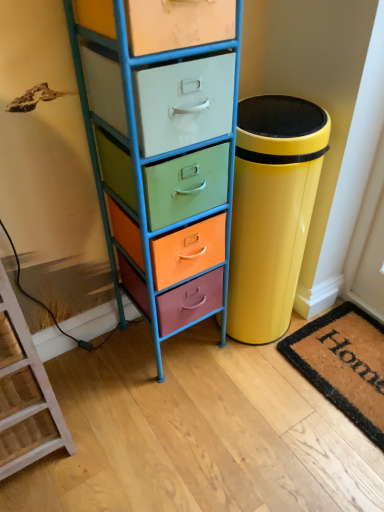
What do you see at coordinates (24, 393) in the screenshot?
I see `wooden ladder at lower left` at bounding box center [24, 393].

In order to face metallic multi-colored chest of drawers at left, should I rotate leftwards or rightwards?

You should look left and rotate roughly 3.491 degrees.

Where is `glossy yellow trash can at right`? glossy yellow trash can at right is located at coordinates (272, 210).

Image resolution: width=384 pixels, height=512 pixels. I want to click on wooden ladder at lower left, so click(x=24, y=393).

What's the angular difference between glossy yellow trash can at right and metallic multi-colored chest of drawers at left's facing directions?

There is a 5.59e-05-degree angle between the facing directions of glossy yellow trash can at right and metallic multi-colored chest of drawers at left.

From a real-world perspective, is glossy yellow trash can at right positioned under metallic multi-colored chest of drawers at left based on gravity?

Yes.

Where is `waste container behind the metallic multi-colored chest of drawers at left`? waste container behind the metallic multi-colored chest of drawers at left is located at coordinates (272, 210).

Considering the relative positions of glossy yellow trash can at right and metallic multi-colored chest of drawers at left in the image provided, is glossy yellow trash can at right to the right of metallic multi-colored chest of drawers at left from the viewer's perspective?

Correct, you'll find glossy yellow trash can at right to the right of metallic multi-colored chest of drawers at left.

In terms of height, does glossy yellow trash can at right look taller or shorter compared to coir doormat at lower right?

In the image, glossy yellow trash can at right appears to be taller than coir doormat at lower right.

Based on the photo, choose the correct answer: Is glossy yellow trash can at right inside coir doormat at lower right or outside it?

glossy yellow trash can at right is not enclosed by coir doormat at lower right.

From the picture: Does glossy yellow trash can at right have a smaller size compared to coir doormat at lower right?

No.

Does point (251, 137) come farther from viewer compared to point (314, 339)?

That is False.

Does metallic multi-colored chest of drawers at left have a lesser height compared to coir doormat at lower right?

No.

Is metallic multi-colored chest of drawers at left far from coir doormat at lower right?

That's not correct — metallic multi-colored chest of drawers at left is a little close to coir doormat at lower right.

The height and width of the screenshot is (512, 384). Identify the location of mat below the metallic multi-colored chest of drawers at left (from a real-world perspective). (344, 364).

From the image's perspective, is metallic multi-colored chest of drawers at left above or below coir doormat at lower right?

From the image's perspective, metallic multi-colored chest of drawers at left appears above coir doormat at lower right.

Can you confirm if coir doormat at lower right is smaller than glossy yellow trash can at right?

Indeed, coir doormat at lower right has a smaller size compared to glossy yellow trash can at right.

Is coir doormat at lower right with glossy yellow trash can at right?

No, coir doormat at lower right is not making contact with glossy yellow trash can at right.

In order to click on mat located on the right of glossy yellow trash can at right in this screenshot , I will do `click(344, 364)`.

Does coir doormat at lower right appear on the left side of glossy yellow trash can at right?

No, coir doormat at lower right is not to the left of glossy yellow trash can at right.

In the scene shown: Is coir doormat at lower right turned away from wooden ladder at lower left?

No, wooden ladder at lower left is not at the back of coir doormat at lower right.

Looking at this image, in terms of size, does coir doormat at lower right appear bigger or smaller than wooden ladder at lower left?

coir doormat at lower right is smaller than wooden ladder at lower left.

Is coir doormat at lower right taller or shorter than wooden ladder at lower left?

coir doormat at lower right is shorter than wooden ladder at lower left.

From the image's perspective, which object appears higher, coir doormat at lower right or wooden ladder at lower left?

wooden ladder at lower left.

Which object is more forward, wooden ladder at lower left or metallic multi-colored chest of drawers at left?

wooden ladder at lower left is in front.

Measure the distance between wooden ladder at lower left and metallic multi-colored chest of drawers at left.

wooden ladder at lower left and metallic multi-colored chest of drawers at left are 18.93 inches apart.

Which object is positioned more to the left, wooden ladder at lower left or metallic multi-colored chest of drawers at left?

wooden ladder at lower left is more to the left.

In terms of height, does wooden ladder at lower left look taller or shorter compared to metallic multi-colored chest of drawers at left?

wooden ladder at lower left is shorter than metallic multi-colored chest of drawers at left.

Is wooden ladder at lower left shorter than glossy yellow trash can at right?

No, wooden ladder at lower left is not shorter than glossy yellow trash can at right.

From a real-world perspective, is wooden ladder at lower left under glossy yellow trash can at right?

Incorrect, from a real-world perspective, wooden ladder at lower left is higher than glossy yellow trash can at right.

Is wooden ladder at lower left to the left of glossy yellow trash can at right from the viewer's perspective?

Yes.

Considering the relative sizes of wooden ladder at lower left and glossy yellow trash can at right in the image provided, is wooden ladder at lower left thinner than glossy yellow trash can at right?

In fact, wooden ladder at lower left might be wider than glossy yellow trash can at right.

I want to click on the chest of drawers positioned vertically above the glossy yellow trash can at right (from a real-world perspective), so click(164, 167).

Find the location of a particular element. waste container in front of the coir doormat at lower right is located at coordinates (272, 210).

Based on their spatial positions, is glossy yellow trash can at right or coir doormat at lower right closer to wooden ladder at lower left?

Based on the image, glossy yellow trash can at right appears to be nearer to wooden ladder at lower left.

Looking at the image, which one is located further to glossy yellow trash can at right, metallic multi-colored chest of drawers at left or coir doormat at lower right?

Among the two, coir doormat at lower right is located further to glossy yellow trash can at right.

When comparing their distances from glossy yellow trash can at right, does wooden ladder at lower left or coir doormat at lower right seem closer?

coir doormat at lower right is closer to glossy yellow trash can at right.

In the scene shown: Looking at the image, which one is located closer to coir doormat at lower right, glossy yellow trash can at right or wooden ladder at lower left?

glossy yellow trash can at right is closer to coir doormat at lower right.

Based on their spatial positions, is metallic multi-colored chest of drawers at left or wooden ladder at lower left further from glossy yellow trash can at right?

Based on the image, wooden ladder at lower left appears to be further to glossy yellow trash can at right.

Consider the image. Which object lies nearer to the anchor point glossy yellow trash can at right, wooden ladder at lower left or metallic multi-colored chest of drawers at left?

metallic multi-colored chest of drawers at left lies closer to glossy yellow trash can at right than the other object.

From the image, which object appears to be nearer to coir doormat at lower right, metallic multi-colored chest of drawers at left or wooden ladder at lower left?

Among the two, metallic multi-colored chest of drawers at left is located nearer to coir doormat at lower right.

Which object lies nearer to the anchor point wooden ladder at lower left, glossy yellow trash can at right or metallic multi-colored chest of drawers at left?

metallic multi-colored chest of drawers at left.

Identify the location of waste container situated between metallic multi-colored chest of drawers at left and coir doormat at lower right from left to right. This screenshot has width=384, height=512. (272, 210).

The height and width of the screenshot is (512, 384). I want to click on chest of drawers between wooden ladder at lower left and coir doormat at lower right in the horizontal direction, so click(164, 167).

You are a GUI agent. You are given a task and a screenshot of the screen. Output one action in this format:
    pyautogui.click(x=<x>, y=<y>)
    Task: Click on the waste container between wooden ladder at lower left and coir doormat at lower right
    
    Given the screenshot: What is the action you would take?
    pyautogui.click(x=272, y=210)

The height and width of the screenshot is (512, 384). In order to click on the chest of drawers located between wooden ladder at lower left and glossy yellow trash can at right in the left-right direction in this screenshot , I will do `click(164, 167)`.